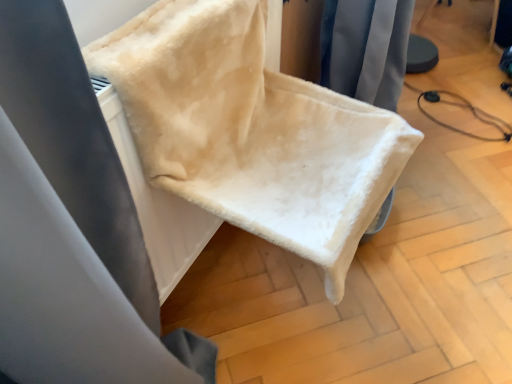
Question: Looking at their shapes, would you say beige fleece blanket at upper left is wider or thinner than white fleece blanket at center?

Choices:
 (A) thin
 (B) wide

Answer: (A)

Question: Relative to white fleece blanket at center, is beige fleece blanket at upper left in front or behind?

Choices:
 (A) behind
 (B) front

Answer: (A)

Question: Is beige fleece blanket at upper left to the left or to the right of white fleece blanket at center in the image?

Choices:
 (A) right
 (B) left

Answer: (B)

Question: In terms of height, does white fleece blanket at center look taller or shorter compared to beige fleece blanket at upper left?

Choices:
 (A) tall
 (B) short

Answer: (B)

Question: Considering the positions of point (175, 187) and point (47, 380), is point (175, 187) closer or farther from the camera than point (47, 380)?

Choices:
 (A) farther
 (B) closer

Answer: (A)

Question: Is white fleece blanket at center in front of or behind beige fleece blanket at upper left in the image?

Choices:
 (A) behind
 (B) front

Answer: (B)

Question: From a real-world perspective, is white fleece blanket at center positioned above or below beige fleece blanket at upper left?

Choices:
 (A) above
 (B) below

Answer: (A)